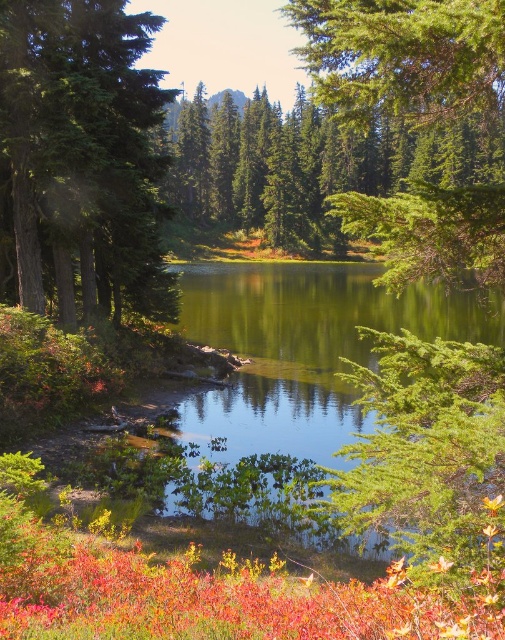
Can you confirm if green reflective water at center is taller than green textured tree at upper right?

No, green reflective water at center is not taller than green textured tree at upper right.

Does green reflective water at center appear over green textured tree at upper right?

No, green reflective water at center is not above green textured tree at upper right.

Find the location of a particular element. The height and width of the screenshot is (640, 505). green reflective water at center is located at coordinates (x=303, y=353).

Which of these two, green matte tree at left or green reflective water at center, stands shorter?

green matte tree at left

Is green matte tree at left positioned at the back of green reflective water at center?

Yes.

Find the location of a particular element. green matte tree at left is located at coordinates (81, 152).

This screenshot has height=640, width=505. Identify the location of green matte tree at left. (81, 152).

From the picture: Is green matte tree at left positioned in front of green textured tree at upper right?

That is False.

Which is behind, point (176, 296) or point (338, 13)?

The point (176, 296) is behind.

The width and height of the screenshot is (505, 640). Identify the location of green matte tree at left. (81, 152).